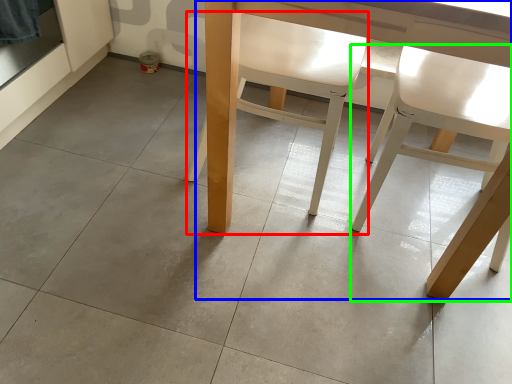
Question: Which is nearer to the chair (highlighted by a red box)? table (highlighted by a blue box) or chair (highlighted by a green box).

Choices:
 (A) table
 (B) chair

Answer: (A)